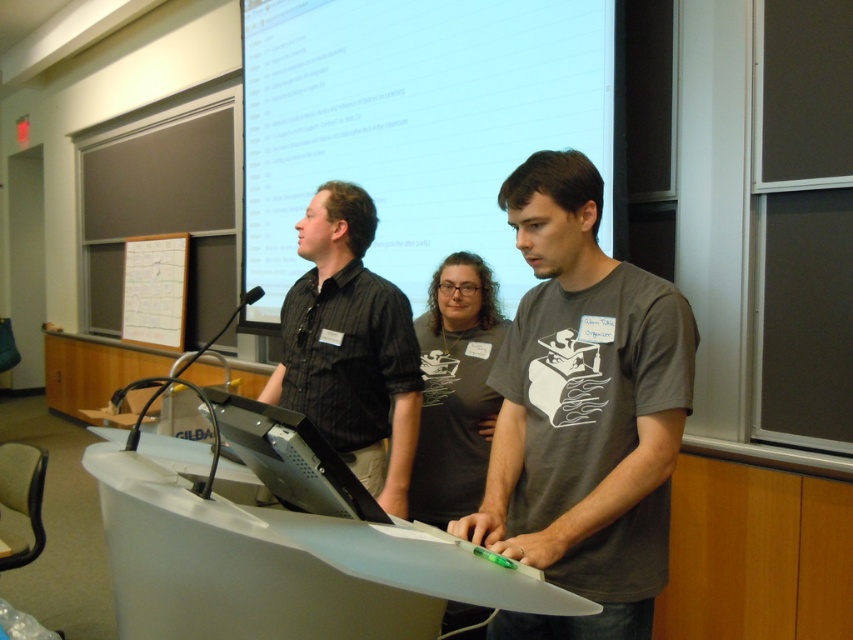
Who is shorter, dark gray t-shirt at center or black glossy monitor at center?

With less height is black glossy monitor at center.

The height and width of the screenshot is (640, 853). I want to click on dark gray t-shirt at center, so click(583, 412).

Which is in front, point (590, 536) or point (258, 468)?

Point (258, 468) is more forward.

I want to click on dark gray t-shirt at center, so click(x=583, y=412).

Can you confirm if dark gray t-shirt at center is thinner than black striped shirt at center?

Indeed, dark gray t-shirt at center has a lesser width compared to black striped shirt at center.

Does dark gray t-shirt at center lie in front of black striped shirt at center?

Yes, it is in front of black striped shirt at center.

Which is in front, point (641, 508) or point (329, 193)?

Point (641, 508) is in front.

The image size is (853, 640). Identify the location of dark gray t-shirt at center. (583, 412).

Between black striped shirt at center and black glossy monitor at center, which one appears on the left side from the viewer's perspective?

From the viewer's perspective, black striped shirt at center appears more on the left side.

Does black striped shirt at center have a lesser width compared to black glossy monitor at center?

In fact, black striped shirt at center might be wider than black glossy monitor at center.

Does point (374, 472) come farther from viewer compared to point (328, 458)?

That is True.

I want to click on black striped shirt at center, so click(350, 346).